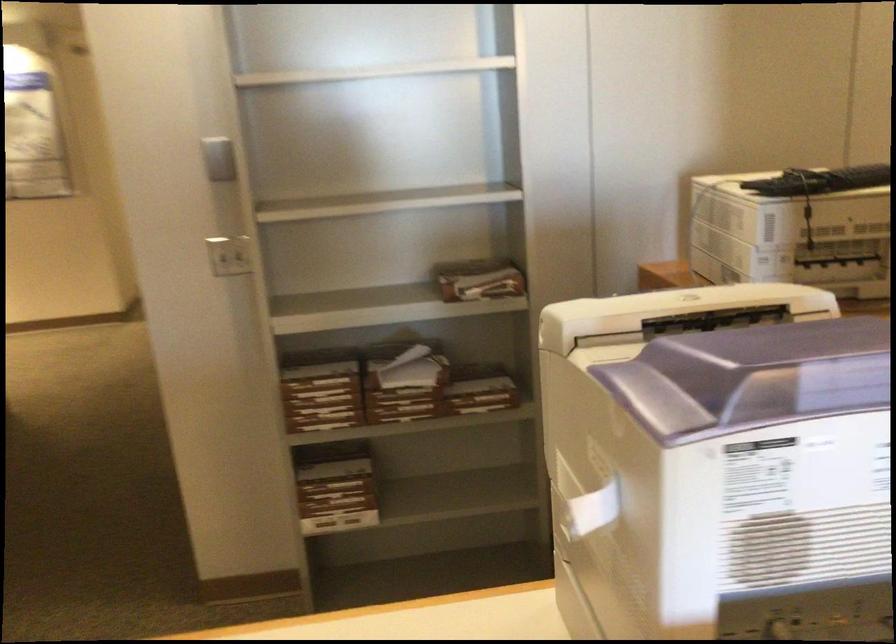
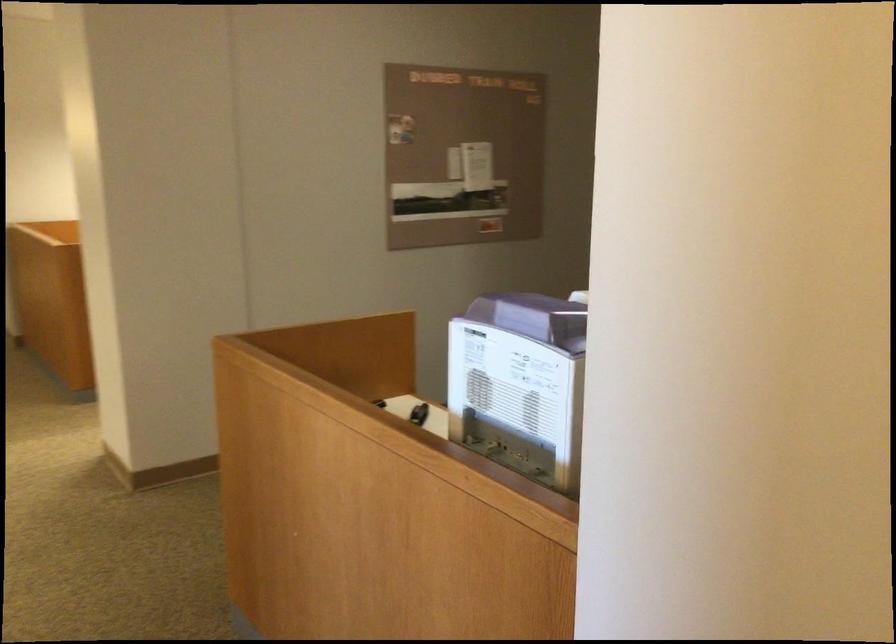
Question: I am providing you with two images of the same scene from different viewpoints. After the viewpoint changes to image2, which objects are now occluded?

Choices:
 (A) small black object
 (B) dark suitcase
 (C) purple machine lid
 (D) wall power outlet

Answer: (D)